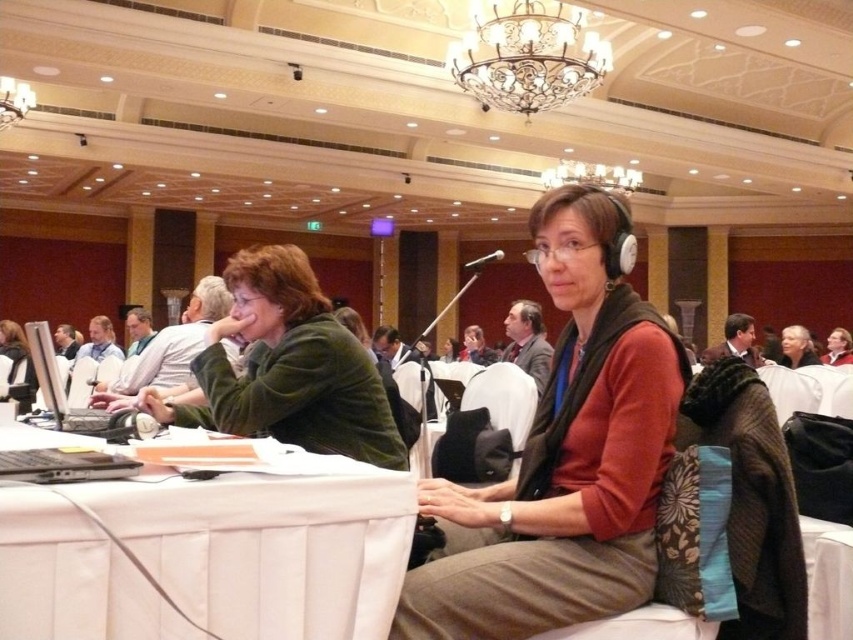
Is point (635, 589) closer to viewer compared to point (537, 19)?

That is True.

Is matte red sweater at center taller than metallic gold chandelier at upper center?

In fact, matte red sweater at center may be shorter than metallic gold chandelier at upper center.

This screenshot has width=853, height=640. What do you see at coordinates (563, 458) in the screenshot? I see `matte red sweater at center` at bounding box center [563, 458].

Find the location of a particular element. This screenshot has width=853, height=640. matte red sweater at center is located at coordinates tap(563, 458).

Is green fuzzy sweater at center further to the viewer compared to black matte laptop at left?

Yes, it is behind black matte laptop at left.

Image resolution: width=853 pixels, height=640 pixels. Describe the element at coordinates (289, 368) in the screenshot. I see `green fuzzy sweater at center` at that location.

Does point (267, 337) come behind point (107, 420)?

Yes, point (267, 337) is behind point (107, 420).

At what (x,y) coordinates should I click in order to perform the action: click on green fuzzy sweater at center. Please return your answer as a coordinate pair (x, y). This screenshot has width=853, height=640. Looking at the image, I should click on (289, 368).

Does metallic gold chandelier at upper center have a lesser height compared to black matte laptop at left?

No.

Who is taller, metallic gold chandelier at upper center or black matte laptop at left?

metallic gold chandelier at upper center is taller.

Measure the distance between metallic gold chandelier at upper center and camera.

They are 7.97 meters apart.

The width and height of the screenshot is (853, 640). What are the coordinates of `metallic gold chandelier at upper center` in the screenshot? It's located at (527, 58).